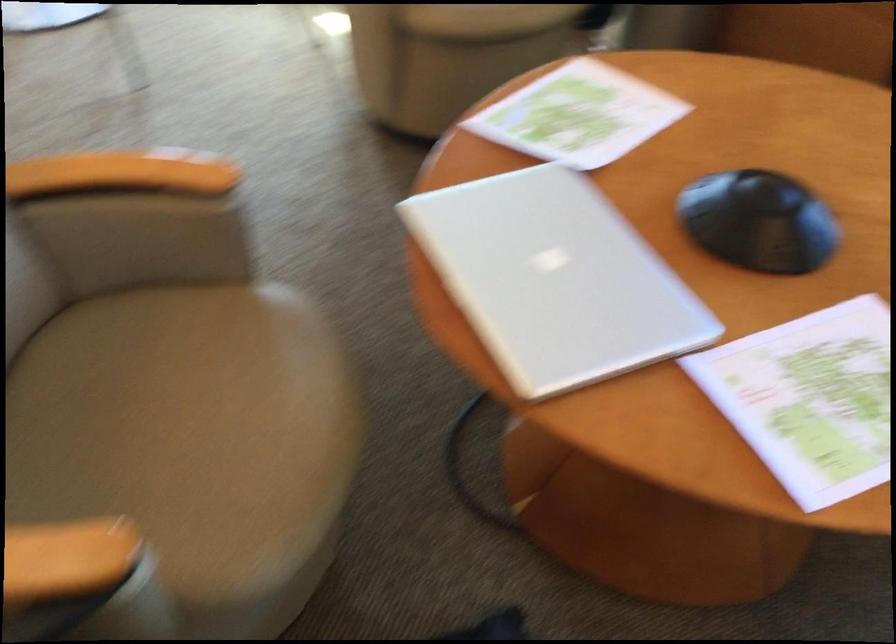
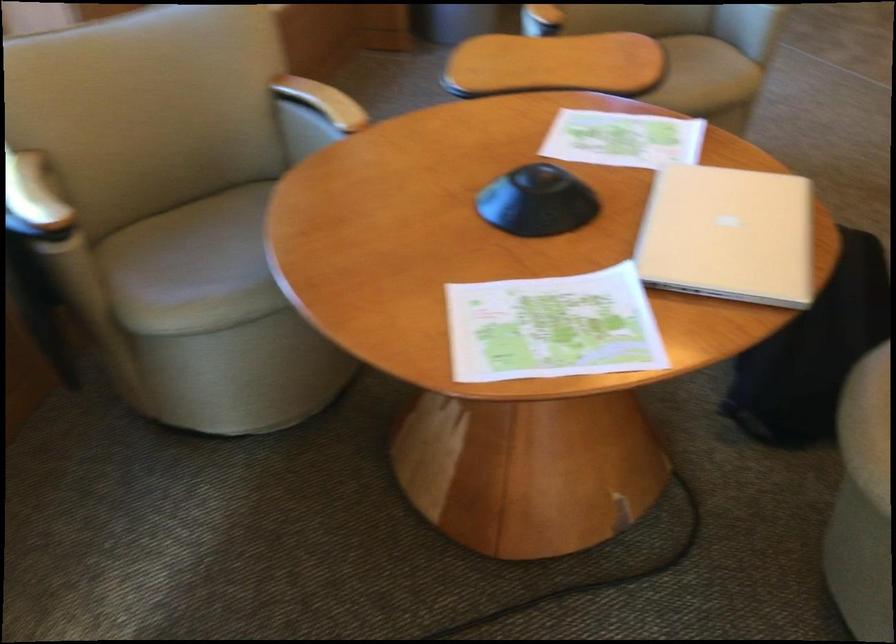
Where in the second image is the point corresponding to pixel 768 484 from the first image?

(623, 138)